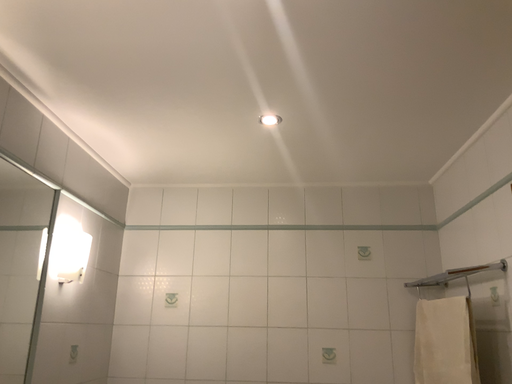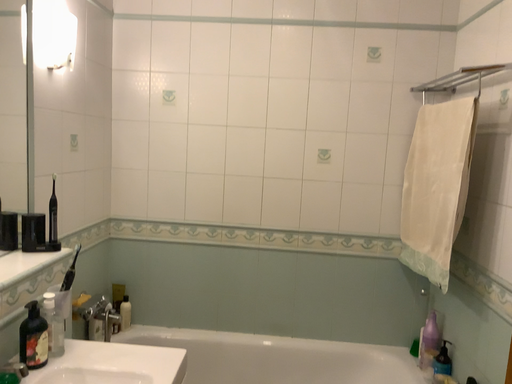
Question: Which way did the camera rotate in the video?

Choices:
 (A) rotated upward
 (B) rotated downward

Answer: (B)